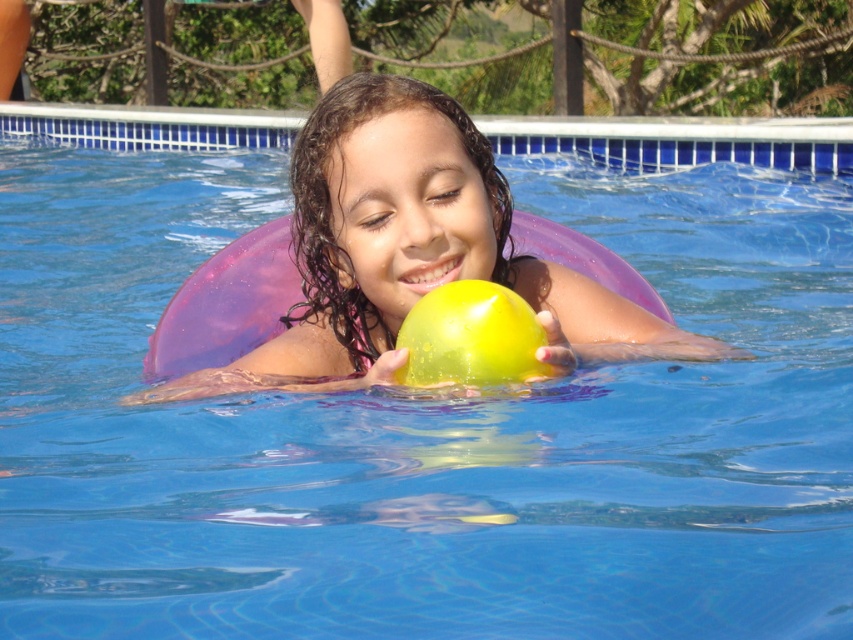
Between yellow rubber ball at center and translucent yellow ball at center, which one has less height?

translucent yellow ball at center is shorter.

Does point (514, 282) come in front of point (480, 291)?

No.

Find the location of a particular element. This screenshot has height=640, width=853. yellow rubber ball at center is located at coordinates point(410,244).

This screenshot has height=640, width=853. What are the coordinates of `yellow rubber ball at center` in the screenshot? It's located at (410, 244).